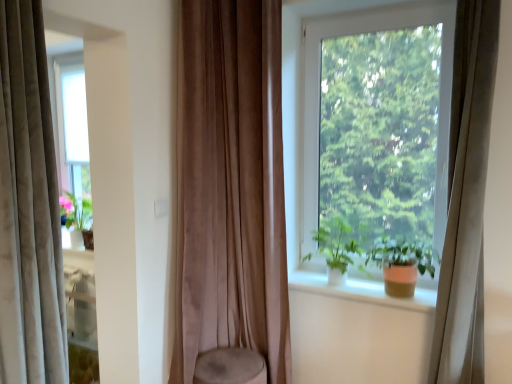
Question: From a real-world perspective, is transparent glass window at center positioned over matte orange pot at window based on gravity?

Choices:
 (A) no
 (B) yes

Answer: (B)

Question: Is transparent glass window at center further to the viewer compared to matte orange pot at window?

Choices:
 (A) no
 (B) yes

Answer: (B)

Question: Can you confirm if transparent glass window at center is thinner than matte orange pot at window?

Choices:
 (A) no
 (B) yes

Answer: (B)

Question: Can you confirm if transparent glass window at center is taller than matte orange pot at window?

Choices:
 (A) yes
 (B) no

Answer: (A)

Question: Is transparent glass window at center aimed at matte orange pot at window?

Choices:
 (A) yes
 (B) no

Answer: (A)

Question: Considering the positions of beige velvet curtain at right, which is the third curtain in left-to-right order, and white smooth window sill at center in the image, is beige velvet curtain at right, which is the third curtain in left-to-right order, wider or thinner than white smooth window sill at center?

Choices:
 (A) wide
 (B) thin

Answer: (B)

Question: Considering the positions of beige velvet curtain at right, arranged as the 1th curtain when viewed from the right, and white smooth window sill at center in the image, is beige velvet curtain at right, arranged as the 1th curtain when viewed from the right, taller or shorter than white smooth window sill at center?

Choices:
 (A) tall
 (B) short

Answer: (A)

Question: In terms of size, does beige velvet curtain at right, which is the third curtain in left-to-right order, appear bigger or smaller than white smooth window sill at center?

Choices:
 (A) small
 (B) big

Answer: (B)

Question: Is beige velvet curtain at right, arranged as the 1th curtain when viewed from the right, spatially inside white smooth window sill at center, or outside of it?

Choices:
 (A) inside
 (B) outside

Answer: (B)

Question: From their relative heights in the image, would you say matte orange pot at window is taller or shorter than suede-like brown curtain at center, the second curtain viewed from the right?

Choices:
 (A) short
 (B) tall

Answer: (A)

Question: From the image's perspective, relative to suede-like brown curtain at center, the second curtain viewed from the right, is matte orange pot at window above or below?

Choices:
 (A) above
 (B) below

Answer: (B)

Question: Which is correct: matte orange pot at window is inside suede-like brown curtain at center, the 2th curtain viewed from the left, or outside of it?

Choices:
 (A) inside
 (B) outside

Answer: (B)

Question: In terms of width, does matte orange pot at window look wider or thinner when compared to suede-like brown curtain at center, the second curtain viewed from the right?

Choices:
 (A) thin
 (B) wide

Answer: (B)

Question: Considering the relative positions of matte orange pot at window and transparent glass window at center in the image provided, is matte orange pot at window to the left or to the right of transparent glass window at center?

Choices:
 (A) left
 (B) right

Answer: (B)

Question: Is matte orange pot at window bigger or smaller than transparent glass window at center?

Choices:
 (A) big
 (B) small

Answer: (B)